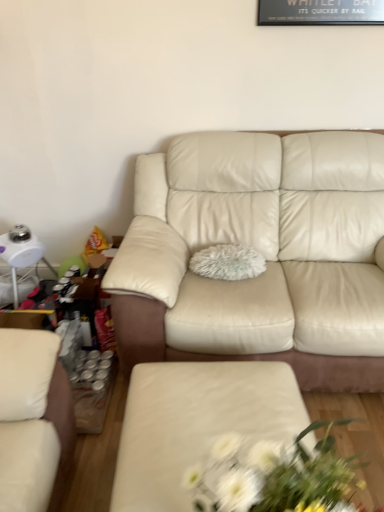
Question: Is white fabric floral arrangement at center to the left of cream leather couch at center from the viewer's perspective?

Choices:
 (A) no
 (B) yes

Answer: (B)

Question: Considering the relative sizes of white fabric floral arrangement at center and cream leather couch at center in the image provided, is white fabric floral arrangement at center bigger than cream leather couch at center?

Choices:
 (A) no
 (B) yes

Answer: (A)

Question: Is white fabric floral arrangement at center thinner than cream leather couch at center?

Choices:
 (A) no
 (B) yes

Answer: (B)

Question: Does white fabric floral arrangement at center have a lesser height compared to cream leather couch at center?

Choices:
 (A) yes
 (B) no

Answer: (A)

Question: Is white fabric floral arrangement at center positioned before cream leather couch at center?

Choices:
 (A) yes
 (B) no

Answer: (A)

Question: Does white fabric floral arrangement at center come behind cream leather couch at center?

Choices:
 (A) no
 (B) yes

Answer: (A)

Question: From the image's perspective, is matte cream ottoman at center located beneath white fabric floral arrangement at center?

Choices:
 (A) yes
 (B) no

Answer: (A)

Question: Does matte cream ottoman at center turn towards white fabric floral arrangement at center?

Choices:
 (A) no
 (B) yes

Answer: (A)

Question: Does matte cream ottoman at center lie behind white fabric floral arrangement at center?

Choices:
 (A) no
 (B) yes

Answer: (B)

Question: From a real-world perspective, is matte cream ottoman at center under white fabric floral arrangement at center?

Choices:
 (A) no
 (B) yes

Answer: (B)

Question: Would you say matte cream ottoman at center is outside white fabric floral arrangement at center?

Choices:
 (A) yes
 (B) no

Answer: (A)

Question: Can you confirm if matte cream ottoman at center is positioned to the left of white fabric floral arrangement at center?

Choices:
 (A) yes
 (B) no

Answer: (A)

Question: From the image's perspective, does cream leather couch at center appear higher than matte cream ottoman at center?

Choices:
 (A) no
 (B) yes

Answer: (B)